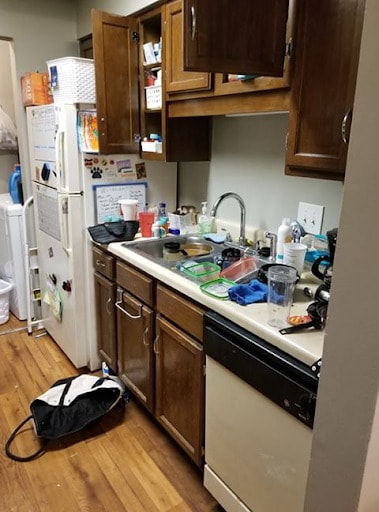
This screenshot has height=512, width=379. What are the coordinates of `sink` in the screenshot? It's located at (150, 247).